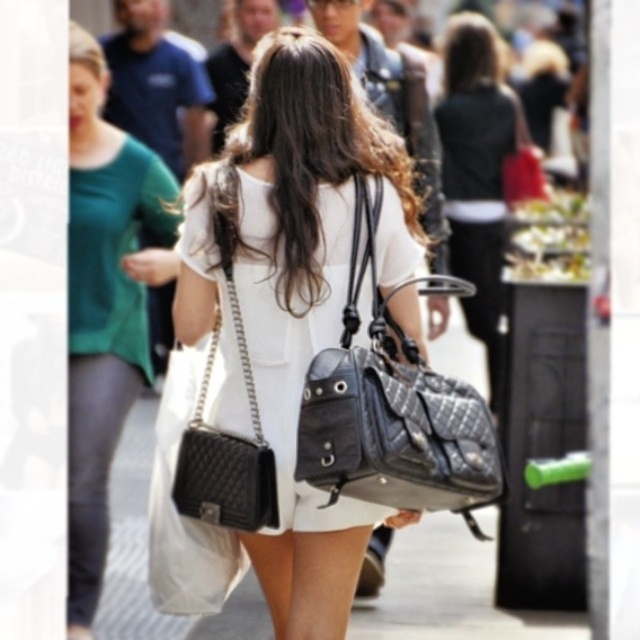
Locate an element on the screen. The width and height of the screenshot is (640, 640). quilted leather shoulder bag at center is located at coordinates (392, 404).

Can you confirm if quilted leather shoulder bag at center is positioned to the left of matte black handbag at center?

Correct, you'll find quilted leather shoulder bag at center to the left of matte black handbag at center.

What do you see at coordinates (392, 404) in the screenshot?
I see `quilted leather shoulder bag at center` at bounding box center [392, 404].

At what (x,y) coordinates should I click in order to perform the action: click on quilted leather shoulder bag at center. Please return your answer as a coordinate pair (x, y). Looking at the image, I should click on (392, 404).

From the picture: Measure the distance between quilted leather shoulder bag at center and matte black handbag at upper right.

quilted leather shoulder bag at center and matte black handbag at upper right are 12.29 meters apart from each other.

Is point (365, 193) more distant than point (509, 173)?

No, it is in front of (509, 173).

Identify the location of quilted leather shoulder bag at center. Image resolution: width=640 pixels, height=640 pixels. (392, 404).

Which is below, white quilted leather handbag at center or matte black handbag at center?

white quilted leather handbag at center is below.

This screenshot has height=640, width=640. Describe the element at coordinates (104, 305) in the screenshot. I see `white quilted leather handbag at center` at that location.

This screenshot has height=640, width=640. What do you see at coordinates (104, 305) in the screenshot?
I see `white quilted leather handbag at center` at bounding box center [104, 305].

The width and height of the screenshot is (640, 640). Identify the location of white quilted leather handbag at center. (104, 305).